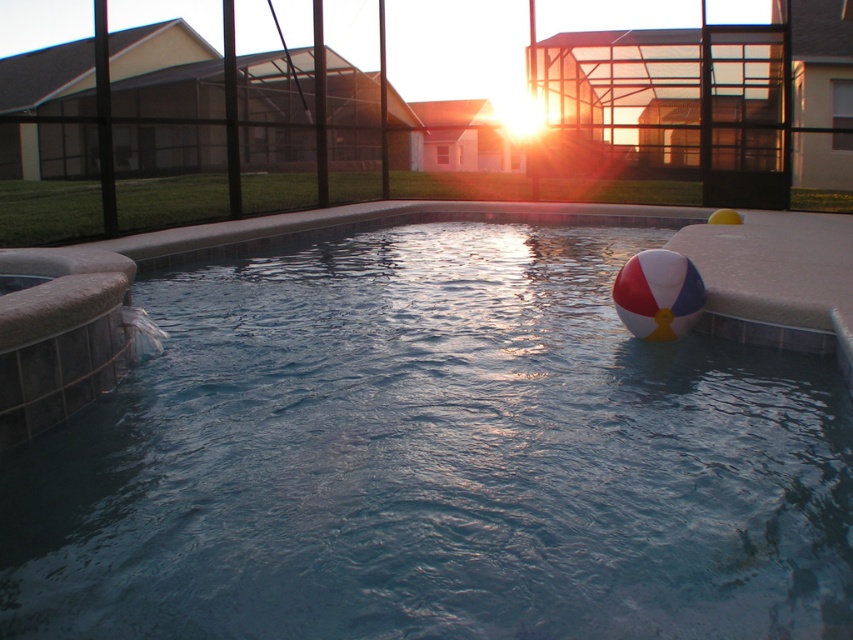
Question: Among these objects, which one is farthest from the camera?

Choices:
 (A) white and red striped beach ball at right
 (B) blue rubber ball at upper right

Answer: (A)

Question: Is blue rubber ball at upper right further to the viewer compared to white and red striped beach ball at right?

Choices:
 (A) no
 (B) yes

Answer: (A)

Question: Is blue rubber ball at upper right smaller than white and red striped beach ball at right?

Choices:
 (A) no
 (B) yes

Answer: (A)

Question: Which object is farther from the camera taking this photo?

Choices:
 (A) white and red striped beach ball at right
 (B) blue rubber ball at upper right

Answer: (A)

Question: Which of the following is the closest to the observer?

Choices:
 (A) 161,513
 (B) 695,291

Answer: (A)

Question: Can you confirm if blue rubber ball at upper right is positioned to the right of white and red striped beach ball at right?

Choices:
 (A) no
 (B) yes

Answer: (A)